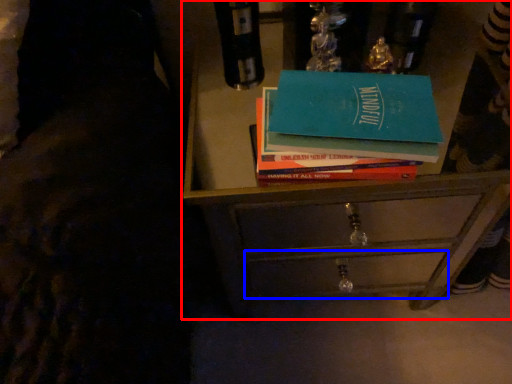
Question: Which object appears farthest to the camera in this image, chest of drawers (highlighted by a red box) or drawer (highlighted by a blue box)?

Choices:
 (A) chest of drawers
 (B) drawer

Answer: (B)